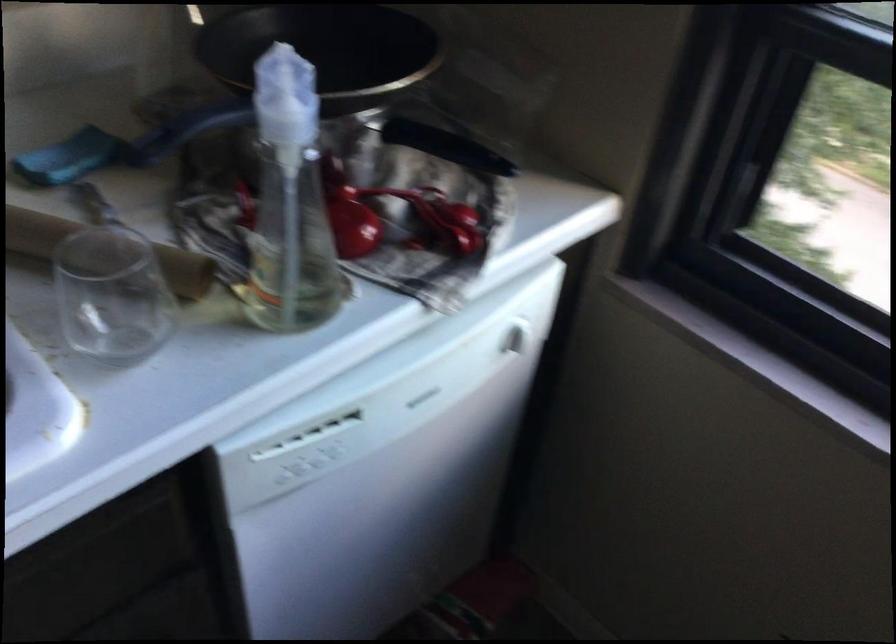
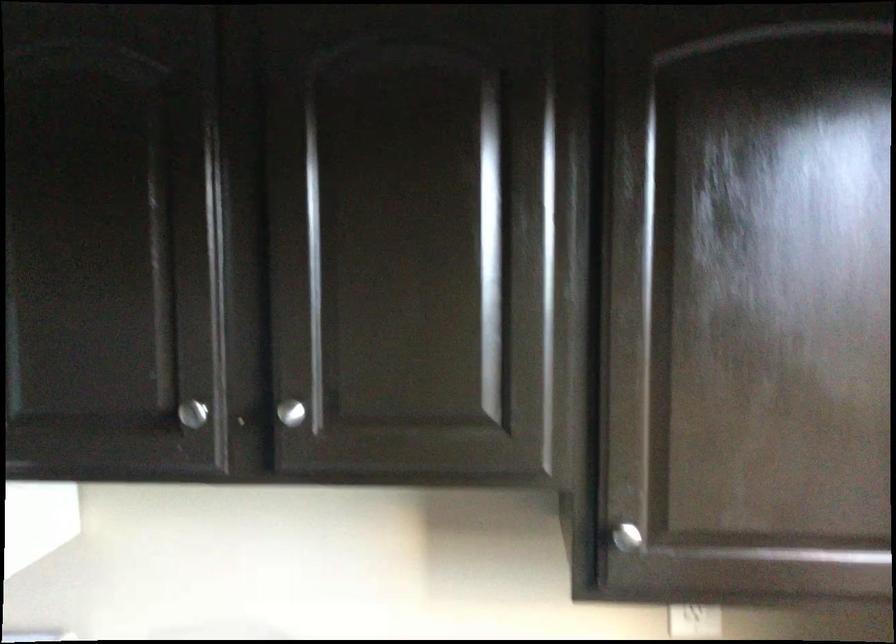
The first image is from the beginning of the video and the second image is from the end. How did the camera likely rotate when shooting the video?

The camera rotated toward left-up.